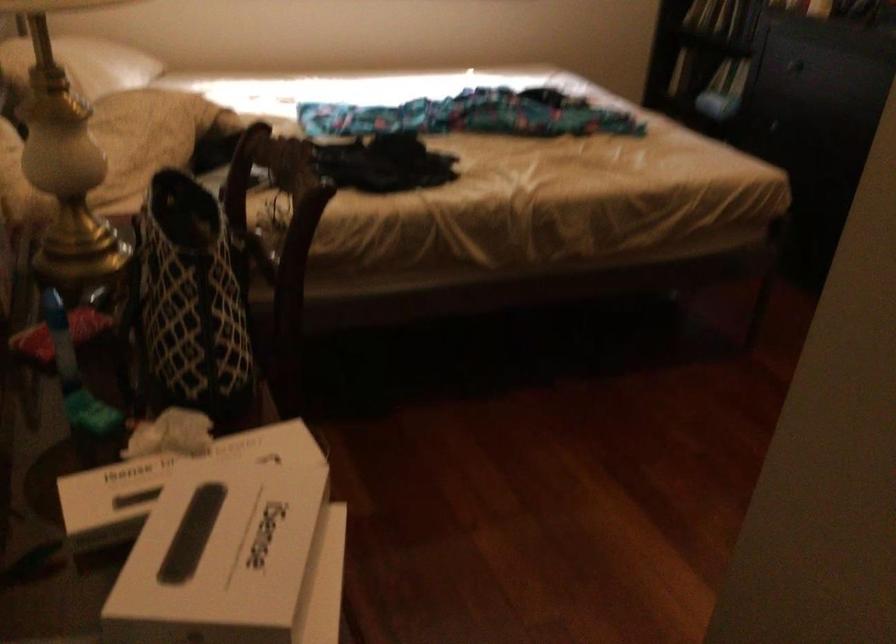
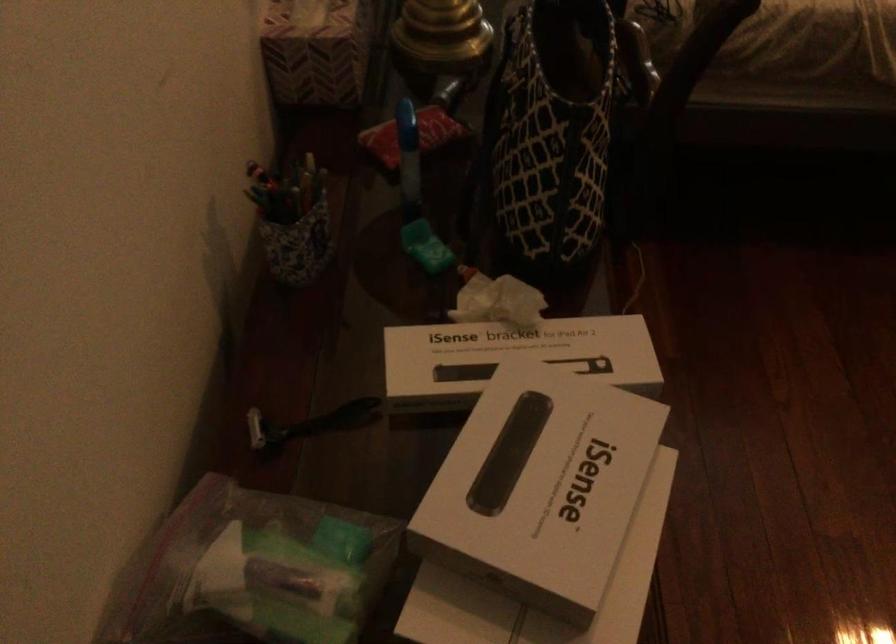
Find the pixel in the second image that matches [188,460] in the first image.

(515, 353)